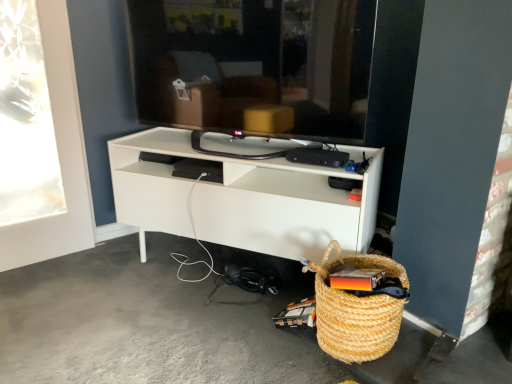
Describe the element at coordinates (255, 65) in the screenshot. I see `black glossy tv at center` at that location.

Image resolution: width=512 pixels, height=384 pixels. I want to click on woven straw basket at lower right, so click(355, 323).

Where is `black glossy tv at center`? This screenshot has height=384, width=512. black glossy tv at center is located at coordinates (255, 65).

Does black glossy tv at center have a greater height compared to white matte shelf at center?

Yes, black glossy tv at center is taller than white matte shelf at center.

Who is smaller, black glossy tv at center or white matte shelf at center?

black glossy tv at center is smaller.

Measure the distance between black glossy tv at center and white matte shelf at center.

black glossy tv at center and white matte shelf at center are 11.33 inches apart from each other.

Consider the image. From a real-world perspective, is black glossy tv at center physically below white matte shelf at center?

Actually, black glossy tv at center is physically above white matte shelf at center in the real world.

Is gray concrete floor at lower left far away from black glossy tv at center?

No, gray concrete floor at lower left is not far away from black glossy tv at center.

How different are the orientations of gray concrete floor at lower left and black glossy tv at center in degrees?

The angle between the facing direction of gray concrete floor at lower left and the facing direction of black glossy tv at center is 58.8 degrees.

Considering the positions of point (83, 311) and point (140, 40), is point (83, 311) closer or farther from the camera than point (140, 40)?

Point (83, 311) appears to be closer to the viewer than point (140, 40).

Could you tell me if gray concrete floor at lower left is turned towards black glossy tv at center?

No, gray concrete floor at lower left is not facing towards black glossy tv at center.

Considering the relative positions of white matte shelf at center and woven straw basket at lower right in the image provided, is white matte shelf at center to the left of woven straw basket at lower right from the viewer's perspective?

Yes, white matte shelf at center is to the left of woven straw basket at lower right.

The image size is (512, 384). Find the location of `shelf located on the left of woven straw basket at lower right`. shelf located on the left of woven straw basket at lower right is located at coordinates (243, 199).

Which is less distant, (134, 151) or (324, 261)?

Point (134, 151) appears to be farther away from the viewer than point (324, 261).

In the image, is gray concrete floor at lower left on the left side or the right side of white matte shelf at center?

Based on their positions, gray concrete floor at lower left is located to the left of white matte shelf at center.

Which is more distant, (126, 377) or (269, 187)?

Point (269, 187)

Considering their positions, is gray concrete floor at lower left located in front of or behind white matte shelf at center?

Visually, gray concrete floor at lower left is located in front of white matte shelf at center.

At what (x,y) coordinates should I click in order to perform the action: click on shelf above the gray concrete floor at lower left (from a real-world perspective). Please return your answer as a coordinate pair (x, y). Looking at the image, I should click on (243, 199).

Considering the relative sizes of woven straw basket at lower right and white matte shelf at center in the image provided, is woven straw basket at lower right thinner than white matte shelf at center?

Yes, woven straw basket at lower right is thinner than white matte shelf at center.

Considering the positions of objects woven straw basket at lower right and white matte shelf at center in the image provided, who is more to the right, woven straw basket at lower right or white matte shelf at center?

Positioned to the right is woven straw basket at lower right.

Looking at this image, relative to white matte shelf at center, is woven straw basket at lower right in front or behind?

woven straw basket at lower right is positioned closer to the viewer than white matte shelf at center.

Is woven straw basket at lower right far from white matte shelf at center?

woven straw basket at lower right is actually quite close to white matte shelf at center.

In the scene shown: From a real-world perspective, does black glossy tv at center sit lower than gray concrete floor at lower left?

No.

Is black glossy tv at center turned away from gray concrete floor at lower left?

No, gray concrete floor at lower left is not at the back of black glossy tv at center.

How different are the orientations of black glossy tv at center and gray concrete floor at lower left in degrees?

There is a 58.8-degree angle between the facing directions of black glossy tv at center and gray concrete floor at lower left.

Is gray concrete floor at lower left at the back of white matte shelf at center?

white matte shelf at center does not have its back to gray concrete floor at lower left.

Considering the positions of point (283, 192) and point (300, 362), is point (283, 192) closer or farther from the camera than point (300, 362)?

Point (283, 192) is positioned farther from the camera compared to point (300, 362).

Does white matte shelf at center contain gray concrete floor at lower left?

No, gray concrete floor at lower left is not inside white matte shelf at center.

From a real-world perspective, is white matte shelf at center under gray concrete floor at lower left?

No, from a real-world perspective, white matte shelf at center is not beneath gray concrete floor at lower left.

Identify the location of television in front of the white matte shelf at center. This screenshot has width=512, height=384. (255, 65).

Locate an element on the screen. The width and height of the screenshot is (512, 384). television behind the gray concrete floor at lower left is located at coordinates (255, 65).

Based on their spatial positions, is gray concrete floor at lower left or woven straw basket at lower right further from white matte shelf at center?

gray concrete floor at lower left lies further to white matte shelf at center than the other object.

Consider the image. When comparing their distances from black glossy tv at center, does white matte shelf at center or gray concrete floor at lower left seem further?

gray concrete floor at lower left is positioned further to the anchor black glossy tv at center.

In the scene shown: Looking at the image, which one is located further to black glossy tv at center, white matte shelf at center or woven straw basket at lower right?

woven straw basket at lower right is positioned further to the anchor black glossy tv at center.

Based on their spatial positions, is white matte shelf at center or black glossy tv at center further from woven straw basket at lower right?

black glossy tv at center lies further to woven straw basket at lower right than the other object.

In the scene shown: Which object lies further to the anchor point black glossy tv at center, gray concrete floor at lower left or white matte shelf at center?

gray concrete floor at lower left is positioned further to the anchor black glossy tv at center.

Considering their positions, is black glossy tv at center positioned closer to gray concrete floor at lower left than woven straw basket at lower right?

woven straw basket at lower right lies closer to gray concrete floor at lower left than the other object.

Considering their positions, is white matte shelf at center positioned closer to gray concrete floor at lower left than black glossy tv at center?

Among the two, white matte shelf at center is located nearer to gray concrete floor at lower left.

From the image, which object appears to be nearer to black glossy tv at center, gray concrete floor at lower left or woven straw basket at lower right?

The object closer to black glossy tv at center is woven straw basket at lower right.

Find the location of `shelf between black glossy tv at center and woven straw basket at lower right in the vertical direction`. shelf between black glossy tv at center and woven straw basket at lower right in the vertical direction is located at coordinates (243, 199).

Identify the location of basket between gray concrete floor at lower left and white matte shelf at center from front to back. The width and height of the screenshot is (512, 384). pos(355,323).

Find the location of a particular element. shelf that lies between black glossy tv at center and gray concrete floor at lower left from top to bottom is located at coordinates (243, 199).

Image resolution: width=512 pixels, height=384 pixels. What are the coordinates of `basket between black glossy tv at center and gray concrete floor at lower left in the up-down direction` in the screenshot? It's located at (355, 323).